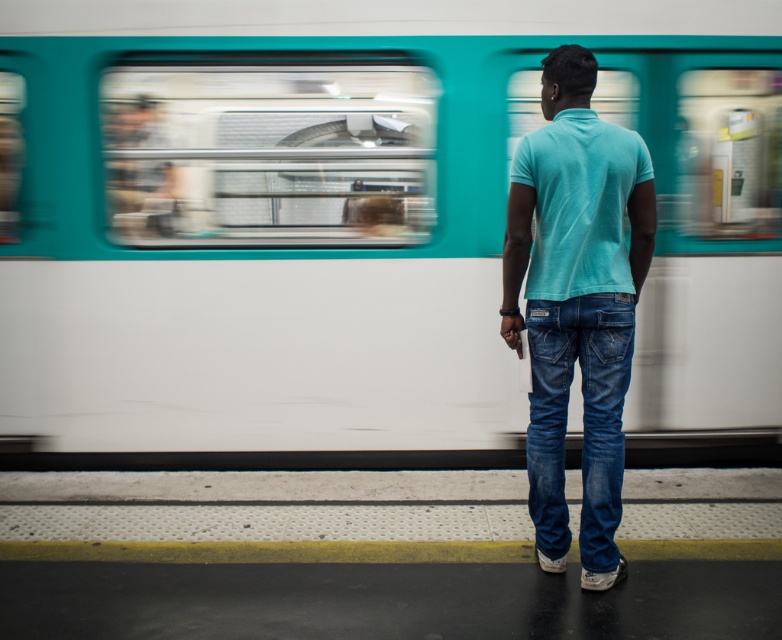
You are a fashion designer observing a person at a subway station wearing denim jeans at center and turquoise cotton polo at center. Which clothing item appears wider?

The denim jeans at center has a lesser width compared to the turquoise cotton polo at center, so the turquoise cotton polo at center appears wider.